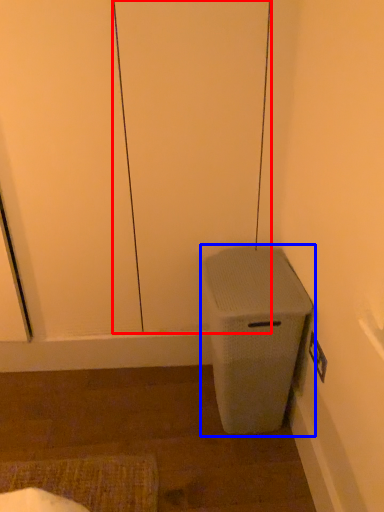
Question: Which of the following is the farthest to the observer, screen door (highlighted by a red box) or waste container (highlighted by a blue box)?

Choices:
 (A) screen door
 (B) waste container

Answer: (B)